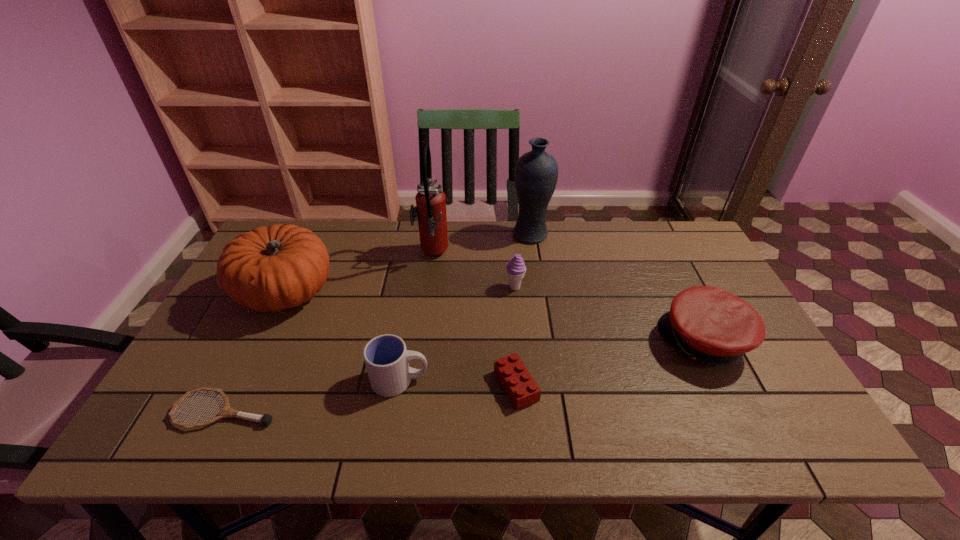
The width and height of the screenshot is (960, 540). Identify the location of free spot located on the right of the sixth shortest object. coord(415,293).

Locate an element on the screen. This screenshot has height=540, width=960. free point located on the back of the icecream is located at coordinates tap(511, 238).

The width and height of the screenshot is (960, 540). Identify the location of free point located 0.270m with the handle on the side of the cup. (541, 381).

This screenshot has width=960, height=540. I want to click on vacant area situated at the front of the rightmost object where the visor is located, so tap(586, 342).

The height and width of the screenshot is (540, 960). In order to click on vacant space located at the front of the rightmost object where the visor is located in this screenshot , I will do `click(536, 342)`.

This screenshot has height=540, width=960. Identify the location of free space located 0.270m at the front of the rightmost object where the visor is located. (559, 342).

Image resolution: width=960 pixels, height=540 pixels. Find the location of `free space located 0.180m on the back of the second shortest object`. free space located 0.180m on the back of the second shortest object is located at coordinates 511,311.

Where is `vacant space located 0.070m on the back of the tennis racket`? vacant space located 0.070m on the back of the tennis racket is located at coordinates (248, 367).

The width and height of the screenshot is (960, 540). I want to click on fire extinguisher that is at the far edge, so click(430, 208).

Find the location of a particular element. This screenshot has width=960, height=540. vase that is at the far edge is located at coordinates (536, 172).